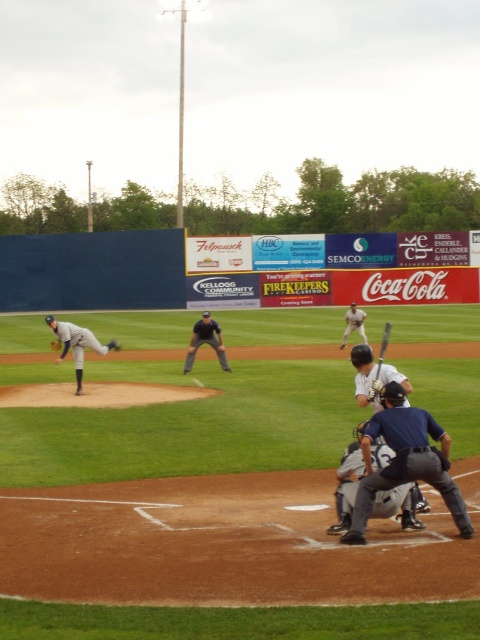
You are a spectator sitting in the stands and want to take a photo of both the gray uniformed pitcher at left and the dark blue uniform at center. Which player should you focus on first to ensure both are in focus?

You should focus on the gray uniformed pitcher at left first because they are closer to you than the dark blue uniform at center, so adjusting focus from near to far will help both be in focus.

You are a coach standing at the dugout and want to signal to both the gray uniformed pitcher at left and the dark blue uniform at center. If your whistle can be heard up to 3 meters away, will both players hear the whistle?

The gray uniformed pitcher at left is 2.63 meters away from dark blue uniform at center. Since the distance between them is within the 3 meters range of the whistle, both players will hear the whistle.